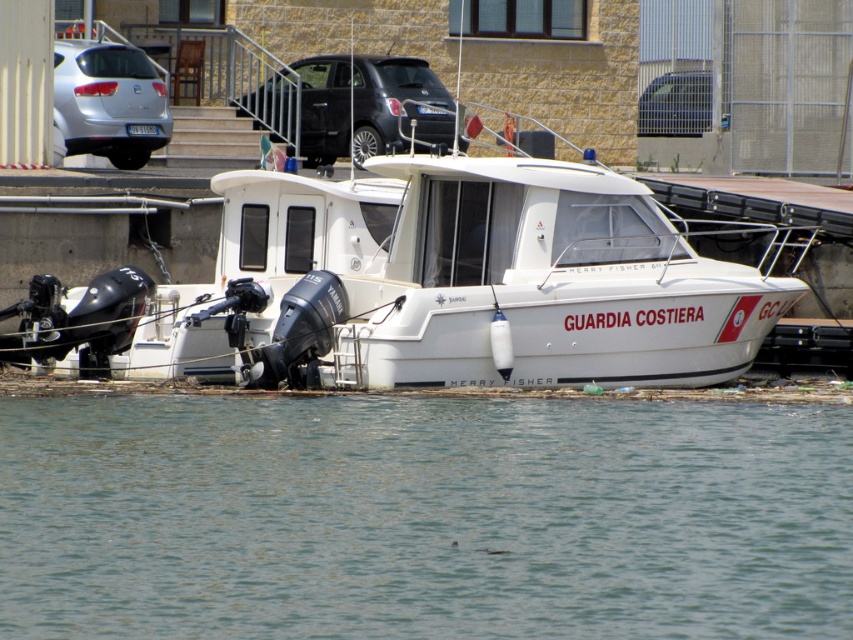
Which is more to the right, white glossy boat at center or metallic silver car at upper center?

metallic silver car at upper center

Locate an element on the screen. white glossy boat at center is located at coordinates (456, 284).

Locate an element on the screen. The image size is (853, 640). white glossy boat at center is located at coordinates (456, 284).

Can you confirm if clear water at center is wider than black matte car at upper center?

Indeed, clear water at center has a greater width compared to black matte car at upper center.

Can you confirm if clear water at center is positioned below black matte car at upper center?

Indeed, clear water at center is positioned under black matte car at upper center.

Describe the element at coordinates (422, 516) in the screenshot. I see `clear water at center` at that location.

In order to click on clear water at center in this screenshot , I will do `click(422, 516)`.

Does black matte car at upper center appear over metallic silver car at upper center?

Actually, black matte car at upper center is below metallic silver car at upper center.

Does black matte car at upper center appear on the right side of metallic silver car at upper center?

No, black matte car at upper center is not to the right of metallic silver car at upper center.

You are a GUI agent. You are given a task and a screenshot of the screen. Output one action in this format:
    pyautogui.click(x=<x>, y=<y>)
    Task: Click on the black matte car at upper center
    
    Given the screenshot: What is the action you would take?
    pyautogui.click(x=370, y=106)

Find the location of a particular element. This screenshot has height=640, width=853. black matte car at upper center is located at coordinates (370, 106).